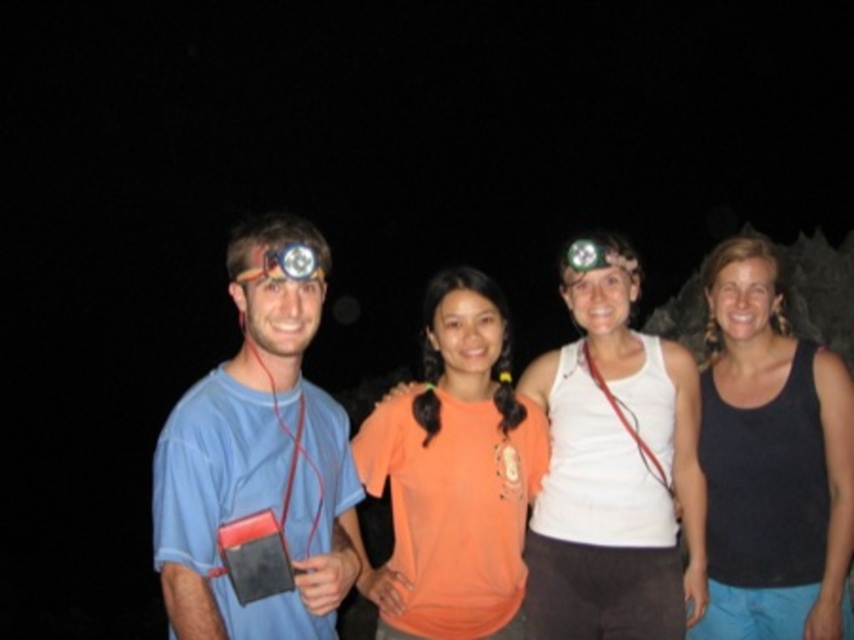
Question: Which is nearer to the black tank top at right?

Choices:
 (A) matte blue t-shirt at left
 (B) orange cotton shirt at center

Answer: (B)

Question: Based on their relative distances, which object is nearer to the black tank top at right?

Choices:
 (A) matte yellow headlamp at left
 (B) matte blue t-shirt at left
 (C) orange matte t-shirt at center
 (D) orange cotton shirt at center

Answer: (D)

Question: Among these objects, which one is farthest from the camera?

Choices:
 (A) orange matte t-shirt at center
 (B) orange cotton shirt at center

Answer: (B)

Question: In this image, where is orange cotton shirt at center located relative to matte yellow headlamp at left?

Choices:
 (A) above
 (B) below

Answer: (B)

Question: Is orange matte t-shirt at center positioned before matte yellow headlamp at left?

Choices:
 (A) yes
 (B) no

Answer: (B)

Question: Is matte blue t-shirt at left to the right of black tank top at right from the viewer's perspective?

Choices:
 (A) yes
 (B) no

Answer: (B)